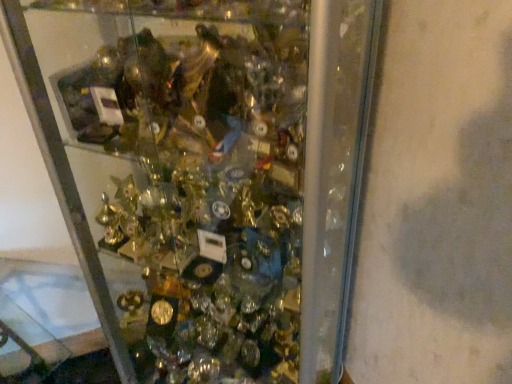
Identify the location of metallic trophy case at center. Image resolution: width=512 pixels, height=384 pixels. (206, 174).

Describe the element at coordinates (206, 174) in the screenshot. This screenshot has width=512, height=384. I see `metallic trophy case at center` at that location.

The height and width of the screenshot is (384, 512). I want to click on metallic trophy case at center, so click(x=206, y=174).